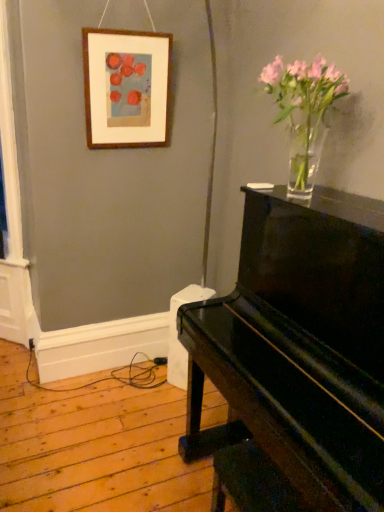
Question: In terms of size, does glossy black piano at right appear bigger or smaller than wooden picture frame at upper left?

Choices:
 (A) big
 (B) small

Answer: (A)

Question: Is glossy black piano at right inside the boundaries of wooden picture frame at upper left, or outside?

Choices:
 (A) inside
 (B) outside

Answer: (B)

Question: Estimate the real-world distances between objects in this image. Which object is closer to the clear glass vase at upper right?

Choices:
 (A) glossy black piano at right
 (B) wooden picture frame at upper left

Answer: (A)

Question: Estimate the real-world distances between objects in this image. Which object is farther from the glossy black piano at right?

Choices:
 (A) clear glass vase at upper right
 (B) wooden picture frame at upper left

Answer: (B)